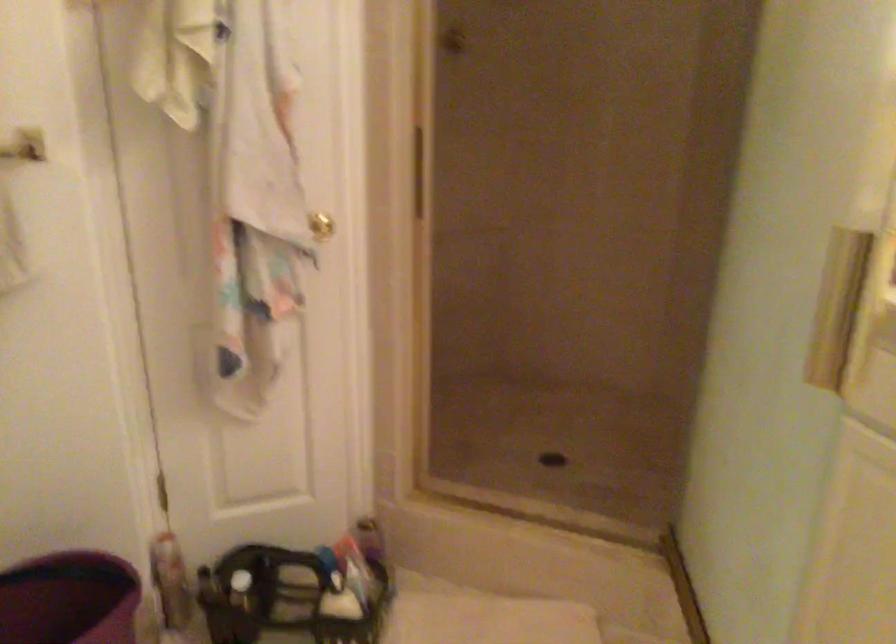
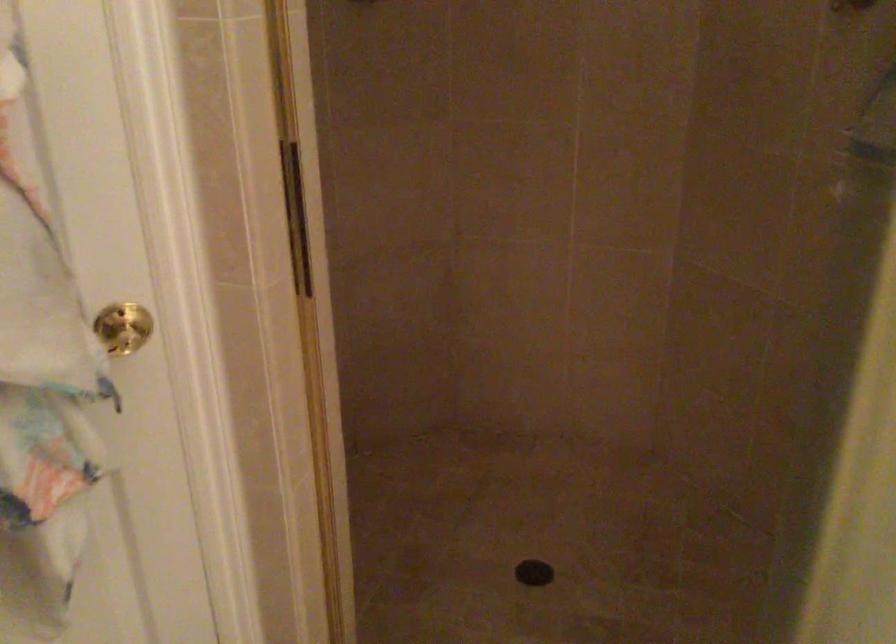
Question: The camera is either moving clockwise (left) or counter-clockwise (right) around the object. The first image is from the beginning of the video and the second image is from the end. Is the camera moving left or right when shooting the video?

Choices:
 (A) Left
 (B) Right

Answer: (A)